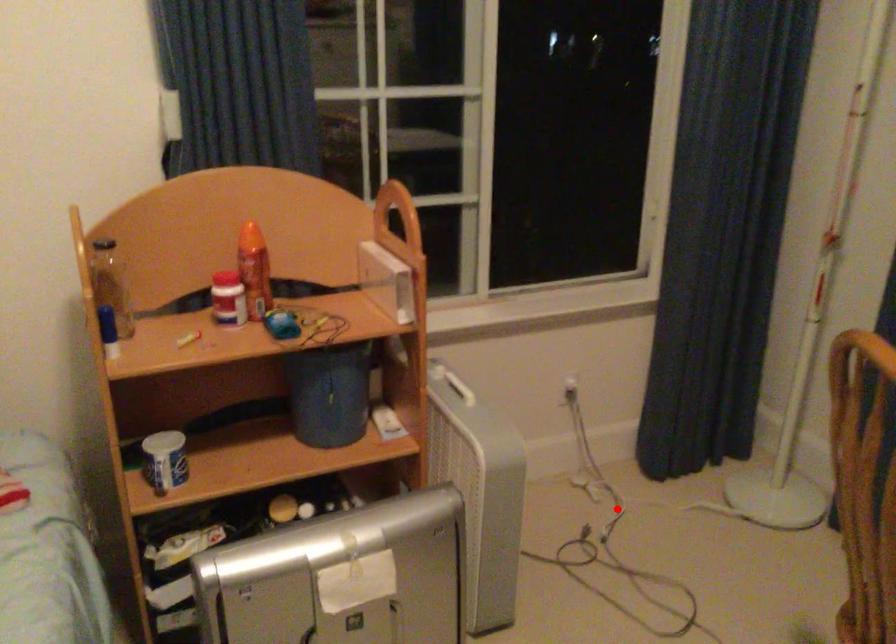
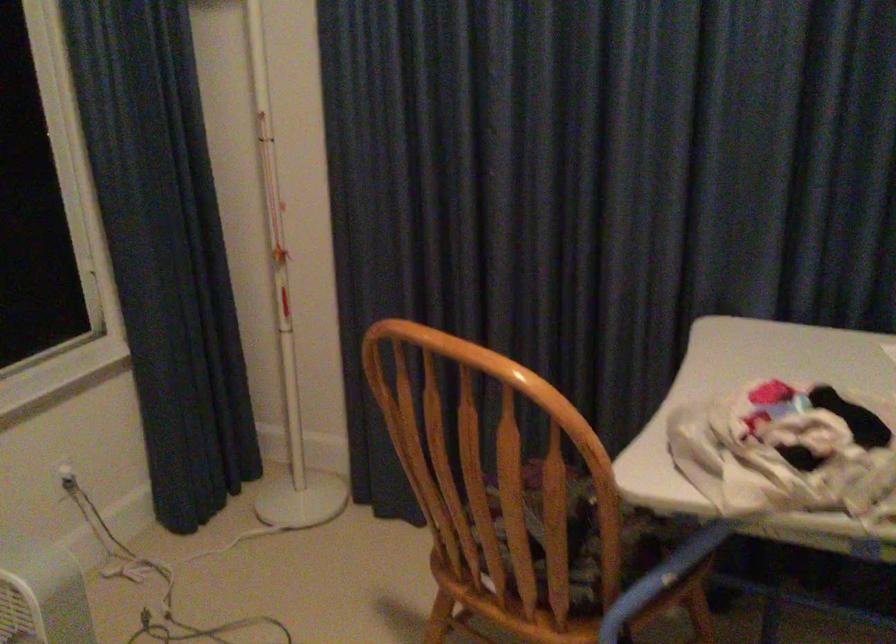
Locate, in the second image, the point that corresponds to the highlighted location in the first image.

(164, 581)